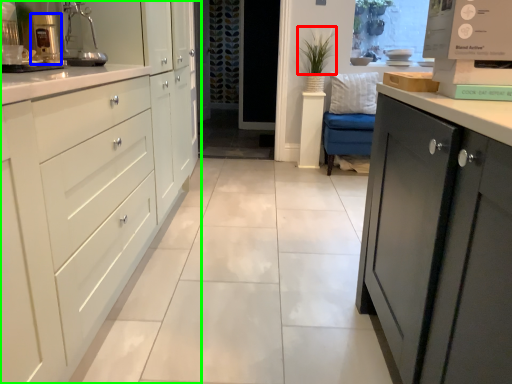
Question: Which object is positioned farthest from plant (highlighted by a red box)? Select from coffee machine (highlighted by a blue box) and cabinetry (highlighted by a green box).

Choices:
 (A) coffee machine
 (B) cabinetry

Answer: (A)